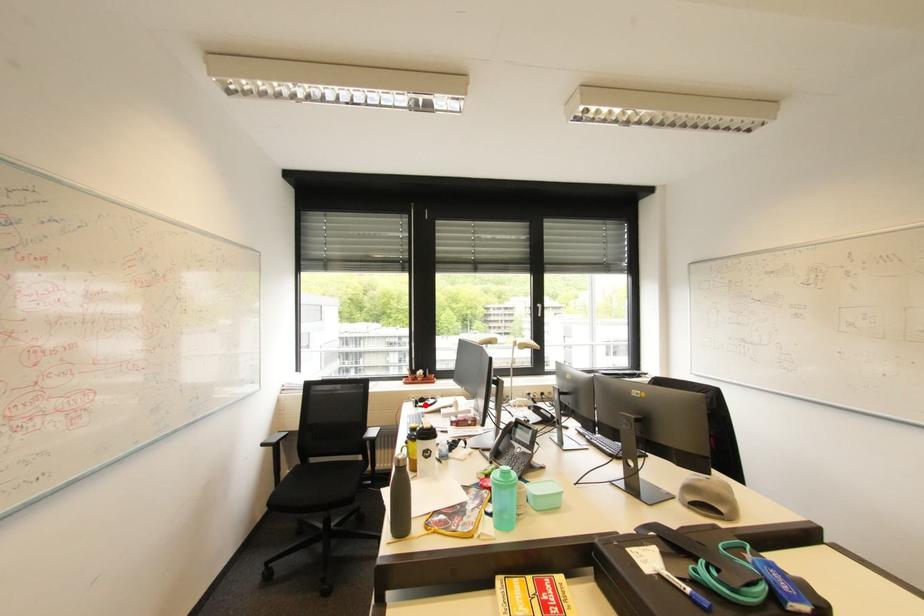
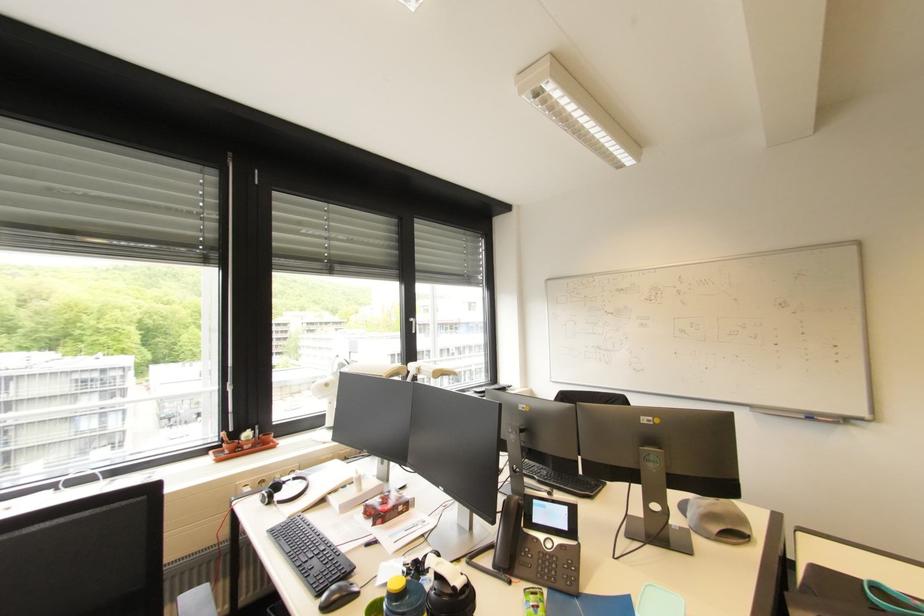
The point at the highlighted location is marked in the first image. Where is the corresponding point in the second image?

(283, 498)